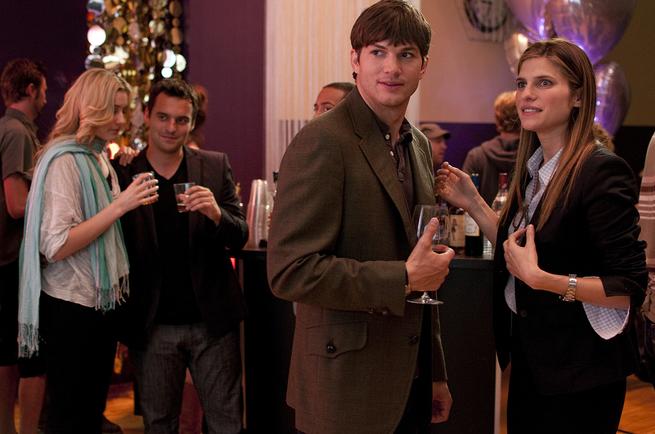
This screenshot has width=655, height=434. In order to click on purple wall in this screenshot , I will do `click(231, 66)`.